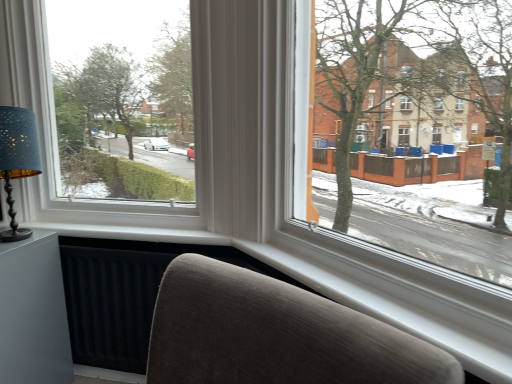
Question: Is white plastic window at upper left in front of matte gray table at lower left?

Choices:
 (A) no
 (B) yes

Answer: (B)

Question: Is white plastic window at upper left at the right side of matte gray table at lower left?

Choices:
 (A) yes
 (B) no

Answer: (A)

Question: Considering the relative sizes of white plastic window at upper left and matte gray table at lower left in the image provided, is white plastic window at upper left shorter than matte gray table at lower left?

Choices:
 (A) yes
 (B) no

Answer: (B)

Question: Is white plastic window at upper left facing away from matte gray table at lower left?

Choices:
 (A) yes
 (B) no

Answer: (B)

Question: Is white plastic window at upper left bigger than matte gray table at lower left?

Choices:
 (A) no
 (B) yes

Answer: (B)

Question: From the image's perspective, is white plastic window at upper left located beneath matte gray table at lower left?

Choices:
 (A) no
 (B) yes

Answer: (A)

Question: Would you say matte gray table at lower left is a long distance from white plastic window at upper left?

Choices:
 (A) yes
 (B) no

Answer: (B)

Question: Does matte gray table at lower left have a lesser height compared to white plastic window at upper left?

Choices:
 (A) yes
 (B) no

Answer: (A)

Question: From a real-world perspective, does matte gray table at lower left stand above white plastic window at upper left?

Choices:
 (A) no
 (B) yes

Answer: (A)

Question: Is matte gray table at lower left bigger than white plastic window at upper left?

Choices:
 (A) yes
 (B) no

Answer: (B)

Question: Can you confirm if matte gray table at lower left is positioned to the right of white plastic window at upper left?

Choices:
 (A) no
 (B) yes

Answer: (A)

Question: Does matte gray table at lower left have a greater width compared to white plastic window at upper left?

Choices:
 (A) no
 (B) yes

Answer: (A)

Question: Is white plastic window at upper left at the right side of matte blue lampshade at left?

Choices:
 (A) yes
 (B) no

Answer: (A)